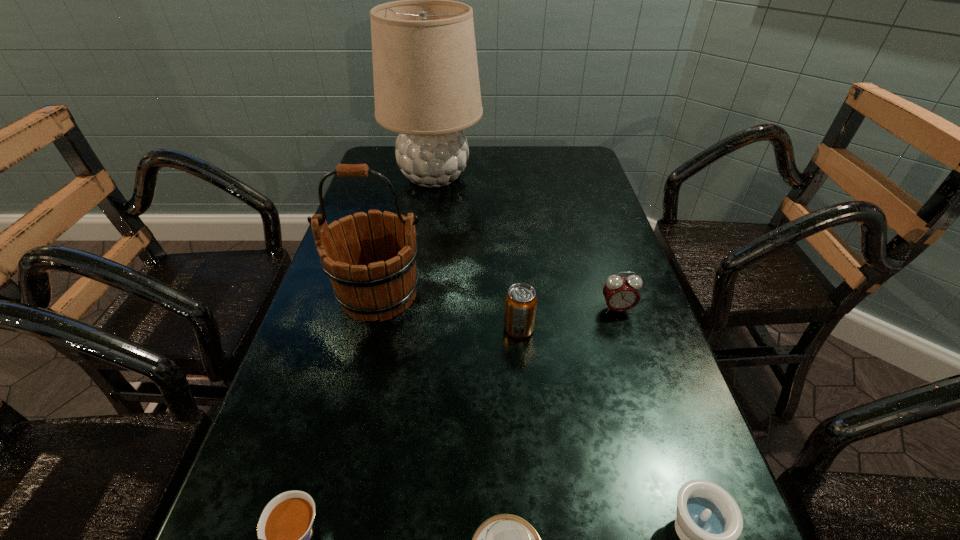
The image size is (960, 540). I want to click on lampshade located at the left edge, so click(x=426, y=82).

Locate an element on the screen. Image resolution: width=960 pixels, height=540 pixels. wine bucket that is at the left edge is located at coordinates (375, 278).

In order to click on object located in the right edge section of the desktop in this screenshot , I will do `click(621, 294)`.

The width and height of the screenshot is (960, 540). In order to click on object present at the far left corner in this screenshot , I will do `click(426, 82)`.

The image size is (960, 540). What are the coordinates of `vacant region at the far edge of the desktop` in the screenshot? It's located at (518, 178).

In the image, there is a desktop. At what (x,y) coordinates should I click in order to perform the action: click on vacant space at the left edge. Please return your answer as a coordinate pair (x, y). Image resolution: width=960 pixels, height=540 pixels. Looking at the image, I should click on (369, 382).

Locate an element on the screen. vacant space at the right edge is located at coordinates (613, 344).

In the image, there is a desktop. In order to click on free region at the far left corner in this screenshot , I will do `click(371, 180)`.

The image size is (960, 540). In order to click on free space at the far right corner of the desktop in this screenshot , I will do `click(545, 148)`.

Locate an element on the screen. vacant space in between the alarm clock and the farthest object is located at coordinates (525, 243).